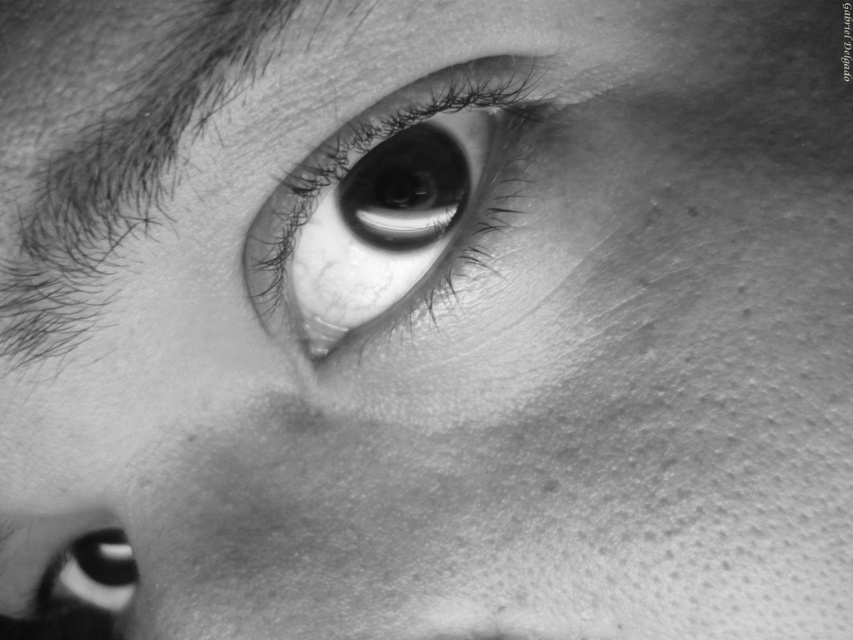
You are an artist analyzing this closeup eye photograph. You see the smooth skin eye at center and the smooth black eye at lower left. Which one is positioned more to the right side of the image?

The smooth skin eye at center is positioned more to the right side of the image than the smooth black eye at lower left.

Based on the scene description, which object is bigger between the smooth skin eye at center and the smooth black eye at lower left?

The smooth skin eye at center is larger than the smooth black eye at lower left.

You are an artist examining the closeup of an eye. You notice two eyes in the image. Which one is closer to you, the smooth skin eye at center or the smooth black eye at lower left?

The smooth skin eye at center is closer to the viewer than the smooth black eye at lower left.